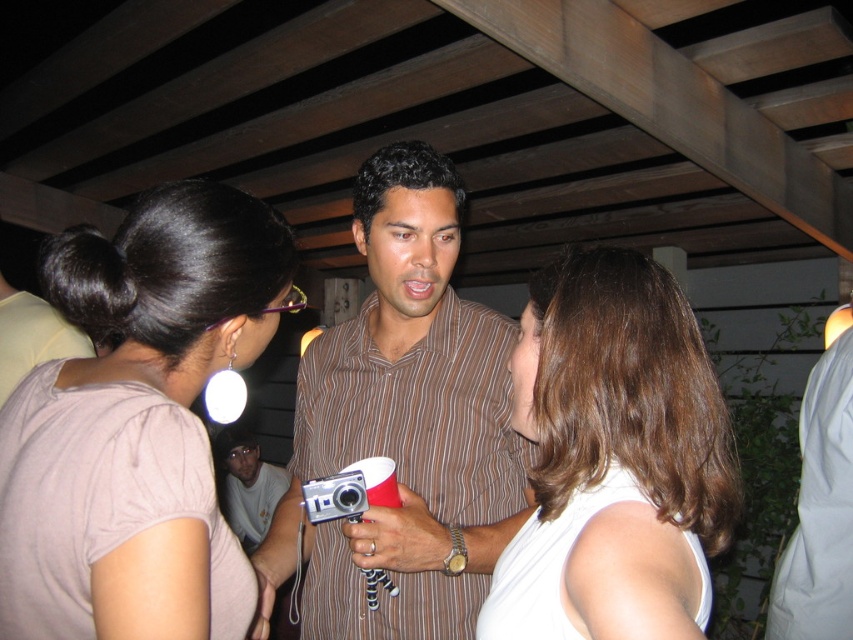
Is brown striped shirt at center in front of gray cotton shirt at center?

Yes, brown striped shirt at center is closer to the viewer.

Who is positioned more to the right, brown striped shirt at center or gray cotton shirt at center?

brown striped shirt at center

Does point (474, 342) come closer to viewer compared to point (267, 488)?

That is True.

Locate an element on the screen. brown striped shirt at center is located at coordinates (403, 424).

Is smooth white tank top at center taller than gray cotton shirt at center?

In fact, smooth white tank top at center may be shorter than gray cotton shirt at center.

Is point (727, 502) in front of point (228, 428)?

That is True.

You are a GUI agent. You are given a task and a screenshot of the screen. Output one action in this format:
    pyautogui.click(x=<x>, y=<y>)
    Task: Click on the smooth white tank top at center
    This screenshot has width=853, height=640.
    Given the screenshot: What is the action you would take?
    pyautogui.click(x=618, y=460)

The image size is (853, 640). Find the location of `smooth white tank top at center`. smooth white tank top at center is located at coordinates (618, 460).

Image resolution: width=853 pixels, height=640 pixels. What do you see at coordinates (137, 422) in the screenshot? I see `matte white earring at upper left` at bounding box center [137, 422].

Does point (189, 376) come behind point (585, 280)?

That is True.

Does point (123, 442) come behind point (627, 305)?

That is False.

At what (x,y) coordinates should I click in order to perform the action: click on matte white earring at upper left. Please return your answer as a coordinate pair (x, y). This screenshot has height=640, width=853. Looking at the image, I should click on (137, 422).